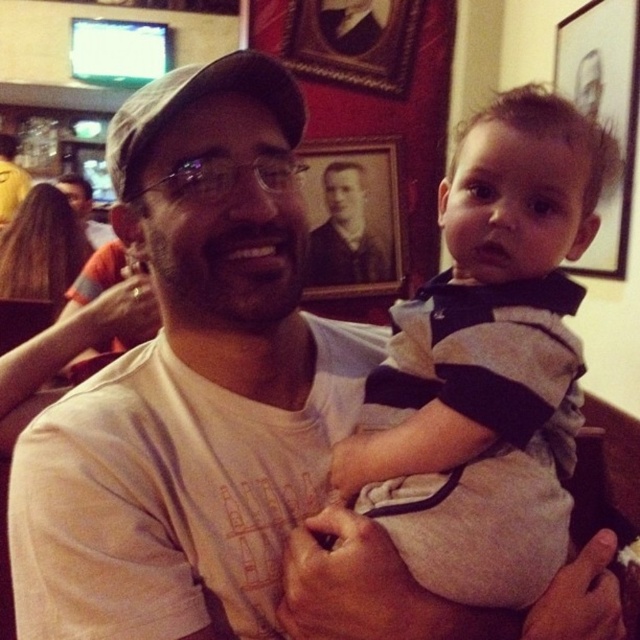
From the picture: You are standing in the restaurant and want to touch the point at coordinates point (422, 355). If your hand can reach up to 70 centimeters, can you reach it?

The point (422, 355) is 73.53 centimeters from the viewer, which is beyond the hand reach of 70 centimeters. You cannot reach it.

Based on the photo, you are a photographer standing at the entrance of the restaurant. You want to take a photo of the striped cotton shirt at center. Where should you position yourself to capture it in the frame?

The striped cotton shirt at center is located at point (486,364), so you should position yourself directly in front of the center of the image to capture it in the frame.

You are a photographer standing at the entrance of the restaurant. You want to capture a closeup of the striped cotton shirt at center without moving any objects. Since your camera has a minimum focusing distance of 24 inches, will you be able to take the photo from your current position?

The striped cotton shirt at center is 24.20 inches from the viewer. Since the minimum focusing distance is 24 inches, you can take the photo from your current position because the shirt is just beyond the minimum requirement.